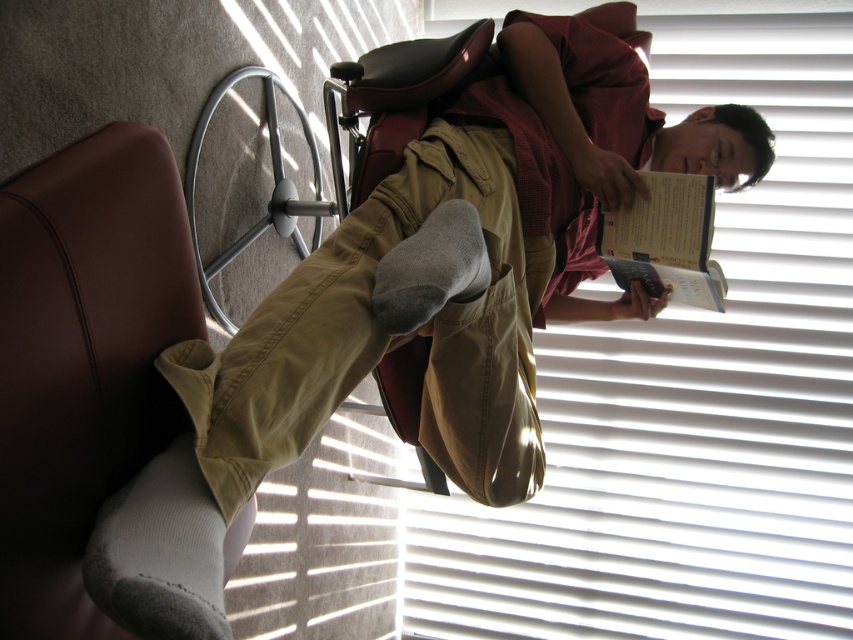
Does khaki cotton pants at center have a smaller size compared to gray fleece sock at center?

Actually, khaki cotton pants at center might be larger than gray fleece sock at center.

Can you confirm if khaki cotton pants at center is positioned to the left of gray fleece sock at center?

Yes, khaki cotton pants at center is to the left of gray fleece sock at center.

Locate an element on the screen. This screenshot has height=640, width=853. khaki cotton pants at center is located at coordinates (384, 339).

Which of these two, khaki cotton pants at center or hardcover book at right, stands taller?

Standing taller between the two is khaki cotton pants at center.

Looking at this image, who is more forward, [503,355] or [676,248]?

Point [503,355] is in front.

Identify the location of khaki cotton pants at center. (384, 339).

Between point (677, 241) and point (473, 288), which one is positioned in front?

Point (473, 288) is in front.

Can you confirm if hardcover book at right is taller than gray fleece sock at center?

Yes, hardcover book at right is taller than gray fleece sock at center.

Who is more distant from viewer, (635, 252) or (428, 248)?

Point (635, 252)

Find the location of a particular element. Image resolution: width=853 pixels, height=640 pixels. hardcover book at right is located at coordinates (665, 241).